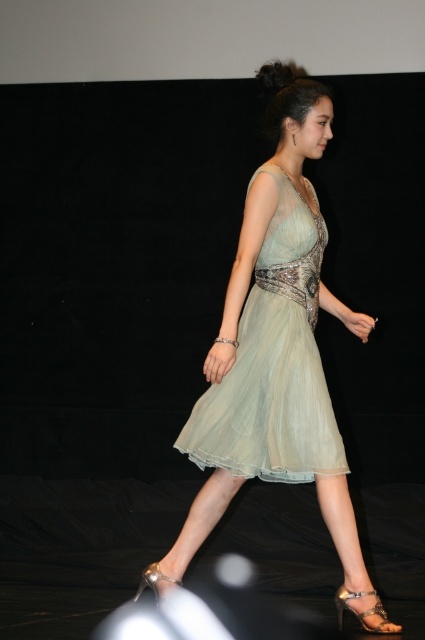
Question: Is light green sheer dress at center in front of metallic silver sandal at lower center?

Choices:
 (A) yes
 (B) no

Answer: (A)

Question: Estimate the real-world distances between objects in this image. Which object is closer to the metallic silver sandal at lower center?

Choices:
 (A) light green sheer dress at center
 (B) satin dress at center

Answer: (A)

Question: From the image, what is the correct spatial relationship of light green sheer dress at center in relation to satin dress at center?

Choices:
 (A) below
 (B) above

Answer: (A)

Question: Considering the relative positions of satin gold sandal at lower center and metallic silver sandal at lower center in the image provided, where is satin gold sandal at lower center located with respect to metallic silver sandal at lower center?

Choices:
 (A) above
 (B) below

Answer: (B)

Question: Which is farther from the light green sheer dress at center?

Choices:
 (A) metallic silver sandal at lower center
 (B) satin dress at center

Answer: (A)

Question: Which point is farther from the camera taking this photo?

Choices:
 (A) pyautogui.click(x=152, y=588)
 (B) pyautogui.click(x=316, y=294)
 (C) pyautogui.click(x=212, y=461)

Answer: (A)